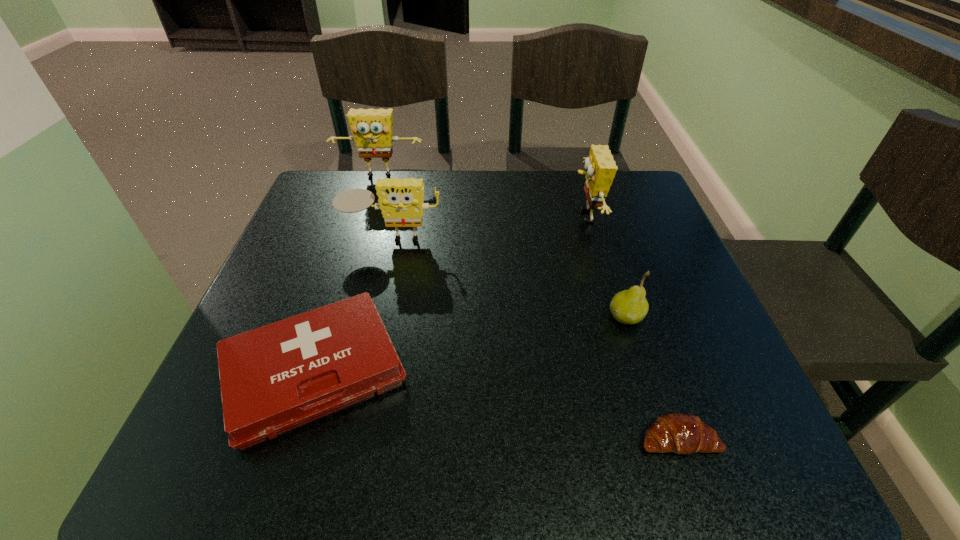
Locate an element on the screen. The height and width of the screenshot is (540, 960). blank space located on the back of the first-aid kit is located at coordinates (369, 201).

Identify the location of vacant space located on the left of the shortest object. This screenshot has width=960, height=540. (514, 439).

Where is `the first-aid kit at the near edge`? the first-aid kit at the near edge is located at coordinates (274, 378).

Locate an element on the screen. The image size is (960, 540). crescent roll at the near edge is located at coordinates (680, 433).

Find the location of `the first-aid kit that is at the left edge`. the first-aid kit that is at the left edge is located at coordinates (274, 378).

Identify the location of sponge that is at the right edge. This screenshot has height=540, width=960. (600, 166).

I want to click on pear that is at the right edge, so click(x=630, y=306).

You are a GUI agent. You are given a task and a screenshot of the screen. Output one action in this format:
    pyautogui.click(x=<x>, y=<y>)
    Task: Click on the crescent roll situated at the right edge
    
    Given the screenshot: What is the action you would take?
    pyautogui.click(x=680, y=433)

Where is `object positioned at the far left corner`? object positioned at the far left corner is located at coordinates (372, 129).

At what (x,y) coordinates should I click in order to perform the action: click on object present at the near left corner. Please return your answer as a coordinate pair (x, y). This screenshot has height=540, width=960. Looking at the image, I should click on (274, 378).